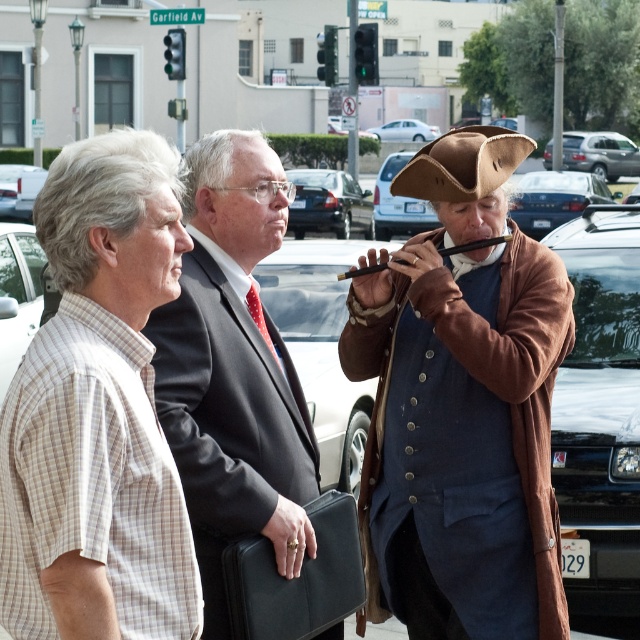
Who is shorter, brown leather coat at center or white matte van at left?

Standing shorter between the two is white matte van at left.

Between brown leather coat at center and white matte van at left, which one is positioned lower?

Positioned lower is brown leather coat at center.

Image resolution: width=640 pixels, height=640 pixels. What do you see at coordinates (461, 406) in the screenshot?
I see `brown leather coat at center` at bounding box center [461, 406].

Locate an element on the screen. brown leather coat at center is located at coordinates (461, 406).

Can you confirm if plaid cotton shirt at left is positioned to the left of matte black sedan at center?

Correct, you'll find plaid cotton shirt at left to the left of matte black sedan at center.

Is plaid cotton shirt at left shorter than matte black sedan at center?

Indeed, plaid cotton shirt at left has a lesser height compared to matte black sedan at center.

I want to click on plaid cotton shirt at left, so click(97, 412).

Is plaid cotton shirt at left thinner than metallic silver car at center?

Yes, plaid cotton shirt at left is thinner than metallic silver car at center.

Based on the photo, is plaid cotton shirt at left to the right of metallic silver car at center from the viewer's perspective?

In fact, plaid cotton shirt at left is to the left of metallic silver car at center.

Where is `plaid cotton shirt at left`? plaid cotton shirt at left is located at coordinates click(x=97, y=412).